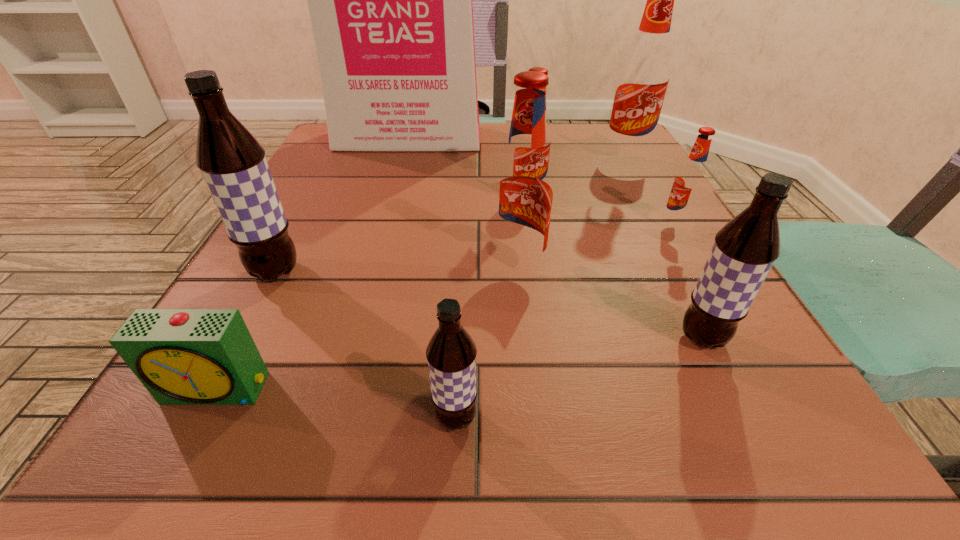
The height and width of the screenshot is (540, 960). Identify the location of shopping bag. (390, 0).

This screenshot has height=540, width=960. Find the location of `the tallest object`. the tallest object is located at coordinates (390, 0).

I want to click on the biggest red root beer, so click(644, 74).

Identify the location of the farthest root beer. This screenshot has width=960, height=540. (644, 74).

This screenshot has width=960, height=540. Find the location of `the third smallest red root beer`. the third smallest red root beer is located at coordinates (523, 191).

Where is `the biggest brown root beer`? The width and height of the screenshot is (960, 540). the biggest brown root beer is located at coordinates (233, 164).

This screenshot has height=540, width=960. I want to click on the leftmost root beer, so click(233, 164).

Where is `the seventh farthest object`? The width and height of the screenshot is (960, 540). the seventh farthest object is located at coordinates (744, 250).

Image resolution: width=960 pixels, height=540 pixels. What are the coordinates of `the rightmost brown root beer` in the screenshot? It's located at (744, 250).

This screenshot has height=540, width=960. Identify the location of the third nearest red root beer. (539, 69).